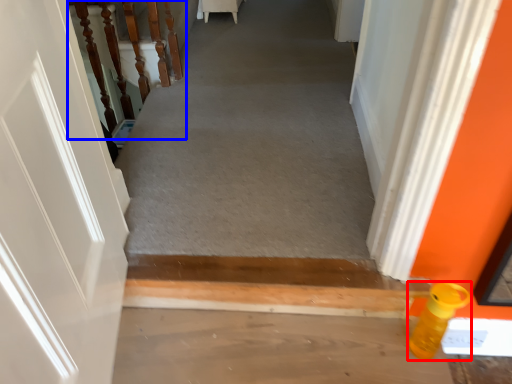
Question: Which point is further to the camera, bottle (highlighted by a red box) or stairwell (highlighted by a blue box)?

Choices:
 (A) bottle
 (B) stairwell

Answer: (B)